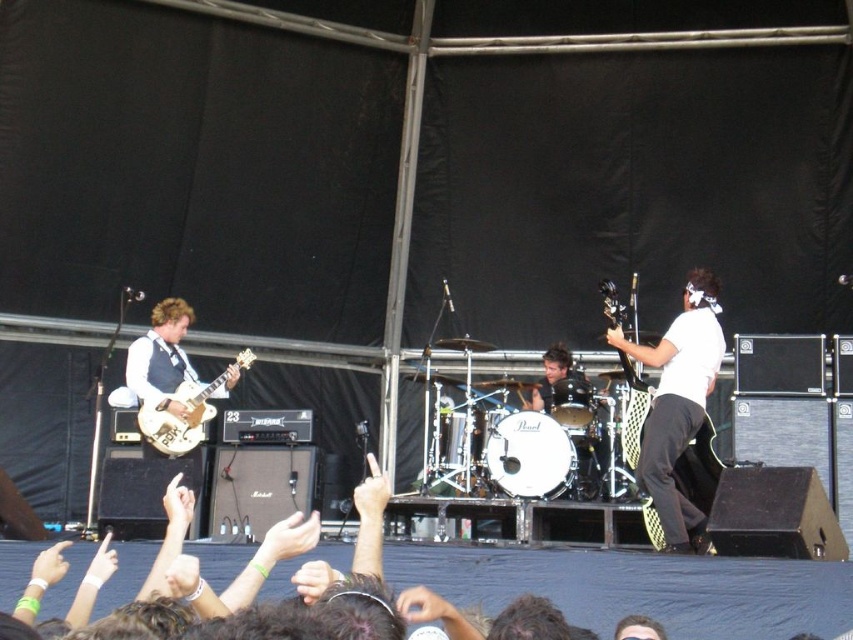
Is white matte guitar at center to the left of matte gold electric guitar at left from the viewer's perspective?

No, white matte guitar at center is not to the left of matte gold electric guitar at left.

How far apart are white matte guitar at center and matte gold electric guitar at left?

The distance of white matte guitar at center from matte gold electric guitar at left is 13.38 meters.

Measure the distance between white matte guitar at center and camera.

A distance of 81.35 feet exists between white matte guitar at center and camera.

I want to click on white matte guitar at center, so click(677, 403).

Which is behind, point (695, 321) or point (236, 378)?

The point (236, 378) is more distant.

Can you confirm if white matte guitar at center is taller than matte gold guitar at left?

Yes.

Does point (660, 406) come in front of point (134, 378)?

Yes, it is.

Locate an element on the screen. This screenshot has width=853, height=640. white matte guitar at center is located at coordinates (677, 403).

Which is more to the right, matte gold guitar at left or matte black electric guitar at right?

Positioned to the right is matte black electric guitar at right.

The height and width of the screenshot is (640, 853). I want to click on matte gold guitar at left, so click(x=161, y=358).

Which is in front, point (172, 388) or point (631, 387)?

Point (631, 387) is in front.

You are a GUI agent. You are given a task and a screenshot of the screen. Output one action in this format:
    pyautogui.click(x=<x>, y=<y>)
    Task: Click on the matte gold guitar at left
    
    Given the screenshot: What is the action you would take?
    pyautogui.click(x=161, y=358)